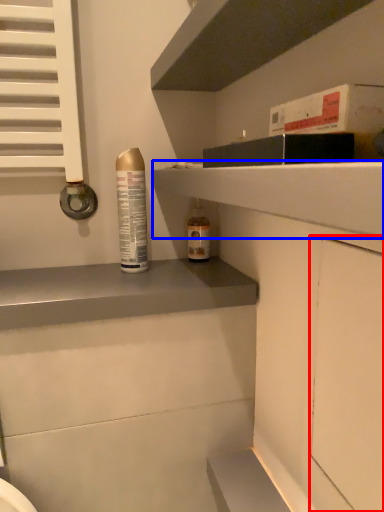
Question: Which object appears closest to the camera in this image, screen door (highlighted by a red box) or shelf (highlighted by a blue box)?

Choices:
 (A) screen door
 (B) shelf

Answer: (A)